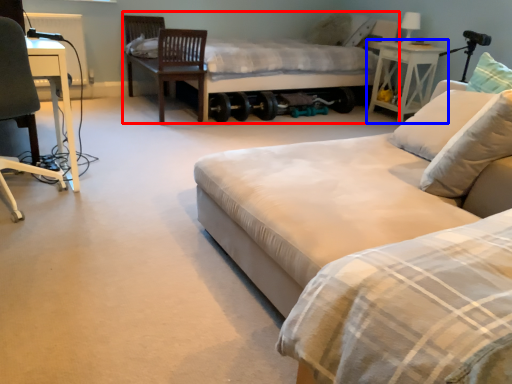
Question: Which point is closer to the camera, bed (highlighted by a red box) or nightstand (highlighted by a blue box)?

Choices:
 (A) bed
 (B) nightstand

Answer: (A)